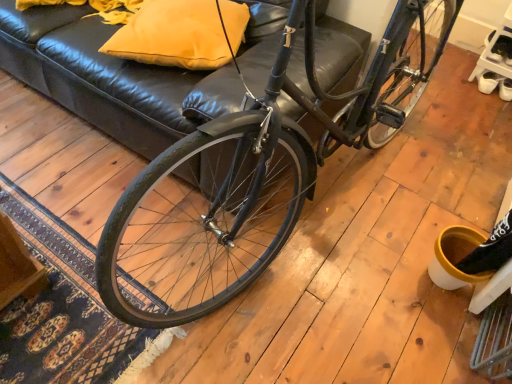
Question: Can you confirm if shiny black bicycle at center is wider than matte yellow pillow at upper center?

Choices:
 (A) yes
 (B) no

Answer: (A)

Question: Does shiny black bicycle at center have a lesser height compared to matte yellow pillow at upper center?

Choices:
 (A) yes
 (B) no

Answer: (B)

Question: Can you confirm if shiny black bicycle at center is smaller than matte yellow pillow at upper center?

Choices:
 (A) yes
 (B) no

Answer: (B)

Question: Is shiny black bicycle at center positioned in front of matte yellow pillow at upper center?

Choices:
 (A) no
 (B) yes

Answer: (B)

Question: Is shiny black bicycle at center not inside matte yellow pillow at upper center?

Choices:
 (A) no
 (B) yes

Answer: (B)

Question: Is shiny black bicycle at center positioned far away from matte yellow pillow at upper center?

Choices:
 (A) no
 (B) yes

Answer: (A)

Question: Are matte yellow pillow at upper center and shiny black bicycle at center making contact?

Choices:
 (A) yes
 (B) no

Answer: (B)

Question: From a real-world perspective, is matte yellow pillow at upper center physically below shiny black bicycle at center?

Choices:
 (A) no
 (B) yes

Answer: (B)

Question: Can you confirm if matte yellow pillow at upper center is taller than shiny black bicycle at center?

Choices:
 (A) no
 (B) yes

Answer: (A)

Question: Is matte yellow pillow at upper center far away from shiny black bicycle at center?

Choices:
 (A) yes
 (B) no

Answer: (B)

Question: Is matte yellow pillow at upper center positioned with its back to shiny black bicycle at center?

Choices:
 (A) no
 (B) yes

Answer: (A)

Question: Is matte yellow pillow at upper center not within shiny black bicycle at center?

Choices:
 (A) yes
 (B) no

Answer: (A)

Question: In terms of size, does shiny black bicycle at center appear bigger or smaller than matte yellow pillow at upper center?

Choices:
 (A) big
 (B) small

Answer: (A)